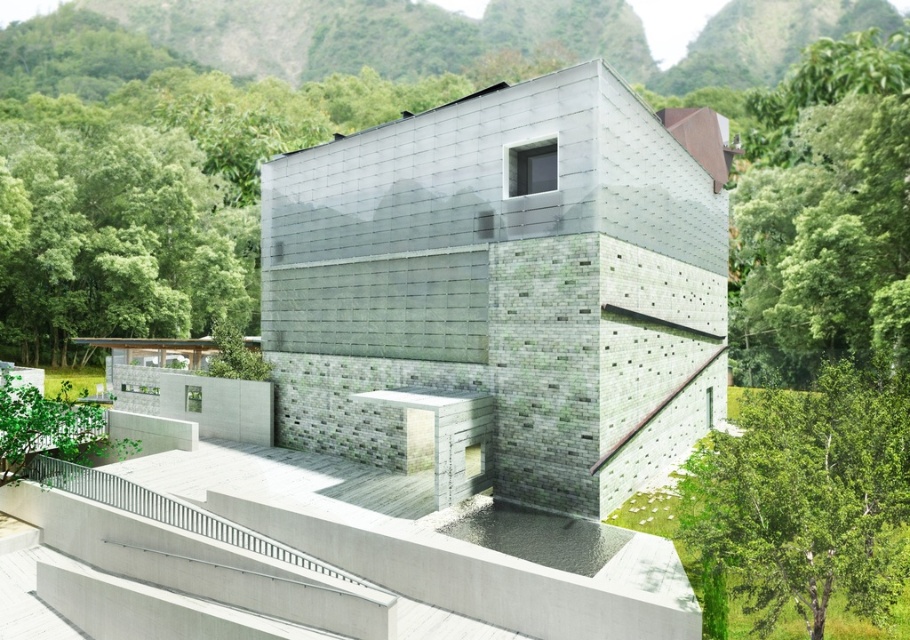
Question: Can you confirm if matte concrete building at center is smaller than green leafy tree at right?

Choices:
 (A) yes
 (B) no

Answer: (A)

Question: Where is matte concrete building at center located in relation to concrete stairs at center in the image?

Choices:
 (A) above
 (B) below

Answer: (A)

Question: Is green leafy tree at center-right positioned before concrete stairs at center?

Choices:
 (A) yes
 (B) no

Answer: (A)

Question: Which point is closer to the camera taking this photo?

Choices:
 (A) (300, 584)
 (B) (273, 307)
 (C) (743, 518)

Answer: (C)

Question: Which point appears closest to the camera in this image?

Choices:
 (A) (703, 541)
 (B) (588, 436)

Answer: (A)

Question: Which object appears closest to the camera in this image?

Choices:
 (A) concrete stairs at center
 (B) green leafy tree at right

Answer: (A)